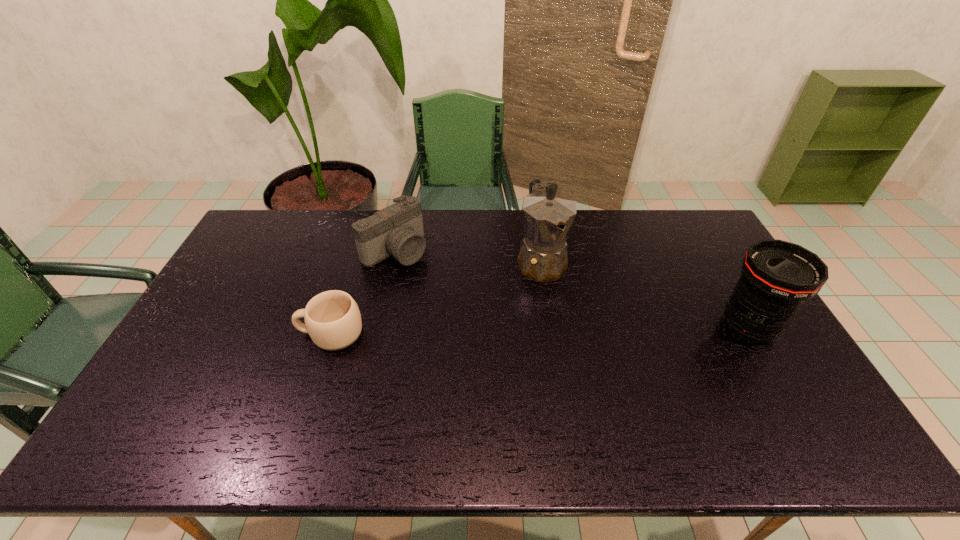
The height and width of the screenshot is (540, 960). In order to click on vacant region located 0.110m on the pouring side of the coffeepot in this screenshot , I will do `click(564, 314)`.

Where is `vacant space located 0.180m on the pouring side of the coffeepot`? The image size is (960, 540). vacant space located 0.180m on the pouring side of the coffeepot is located at coordinates (572, 332).

Find the location of a particular element. vacant space situated 0.330m on the pouring side of the coffeepot is located at coordinates (593, 374).

Find the location of a particular element. free space located at the lens of the third tallest object is located at coordinates (463, 301).

This screenshot has width=960, height=540. In order to click on free space located 0.350m at the lens of the third tallest object in this screenshot , I will do (490, 322).

What are the coordinates of `vacant space located at the lens of the third tallest object` in the screenshot? It's located at (483, 316).

In order to click on coffeepot situated at the far edge in this screenshot , I will do (x=548, y=215).

The width and height of the screenshot is (960, 540). Find the location of `camera located in the far edge section of the desktop`. camera located in the far edge section of the desktop is located at coordinates (397, 230).

Locate an element on the screen. Image resolution: width=960 pixels, height=540 pixels. object at the right edge is located at coordinates (777, 277).

Where is `vacant space at the far edge of the desktop`? This screenshot has height=540, width=960. vacant space at the far edge of the desktop is located at coordinates (366, 215).